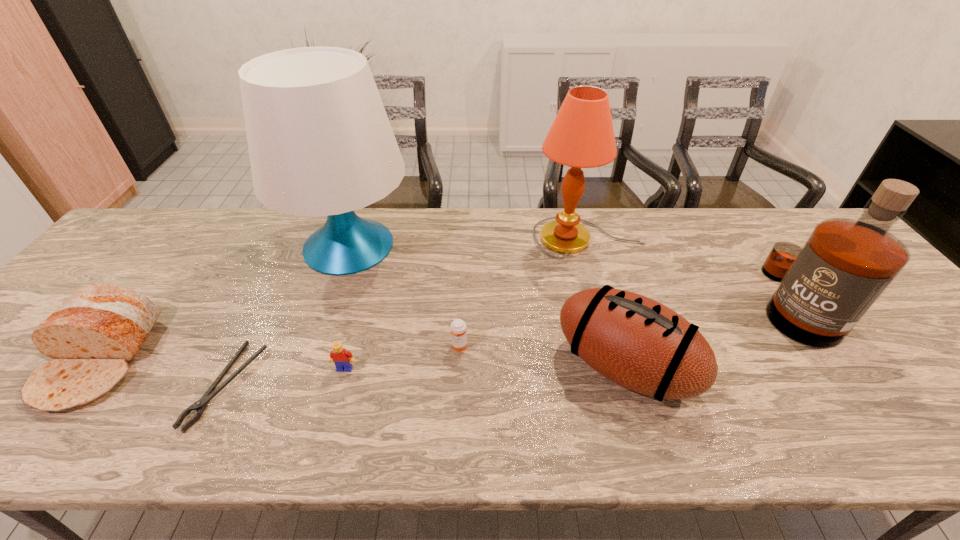
This screenshot has width=960, height=540. In order to click on free space located on the left of the lamp in this screenshot , I will do [516, 238].

The height and width of the screenshot is (540, 960). I want to click on vacant space located on the front label of the rightmost object, so click(691, 302).

I want to click on free space located on the front label of the rightmost object, so click(x=630, y=302).

Find the location of a particular element. The width and height of the screenshot is (960, 540). vacant space situated 0.190m on the front label of the rightmost object is located at coordinates [x=684, y=302].

At what (x,y) coordinates should I click in order to perform the action: click on vacant space positioned 0.230m on the right of the fourth tallest object. Please return your answer as a coordinate pair (x, y). The height and width of the screenshot is (540, 960). Looking at the image, I should click on coord(791,367).

Find the location of a particular element. This screenshot has width=960, height=540. free space located at the sliced end of the leftmost object is located at coordinates (30, 449).

The image size is (960, 540). Find the location of `vacant space situated on the face of the Lego`. vacant space situated on the face of the Lego is located at coordinates (335, 404).

Where is `vacant area located on the front of the medicine`? The image size is (960, 540). vacant area located on the front of the medicine is located at coordinates (457, 404).

Find the location of a particular element. The image size is (960, 540). blank area located 0.330m on the back of the tongs is located at coordinates (291, 254).

Image resolution: width=960 pixels, height=540 pixels. In order to click on table lamp at the far edge in this screenshot , I will do `click(320, 143)`.